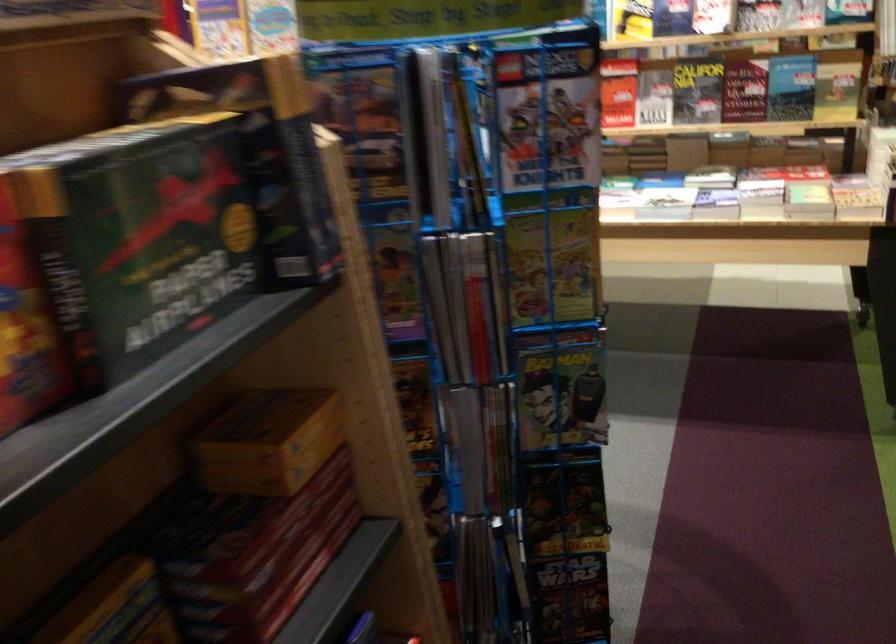
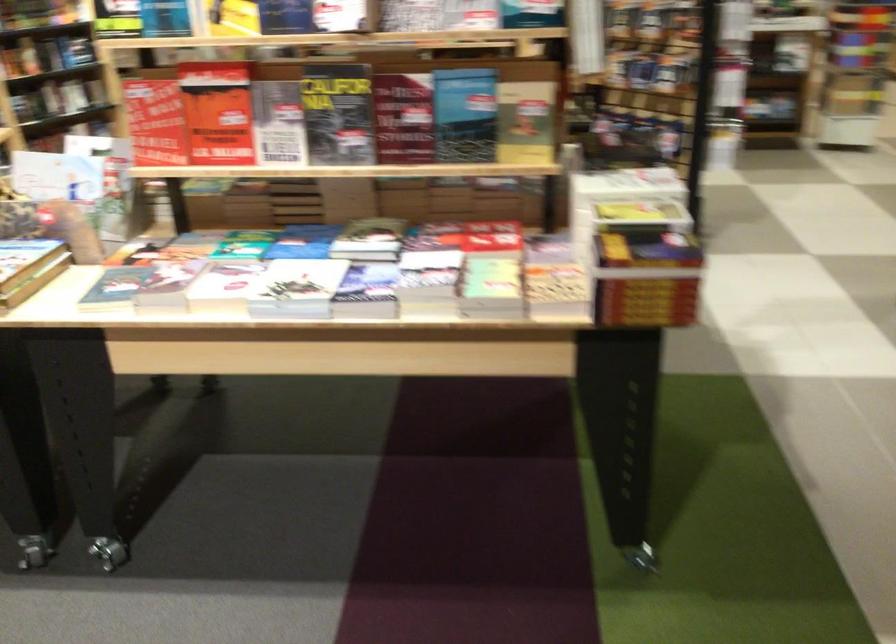
Find the pixel in the second image that matches point (753, 79) in the first image.

(403, 118)